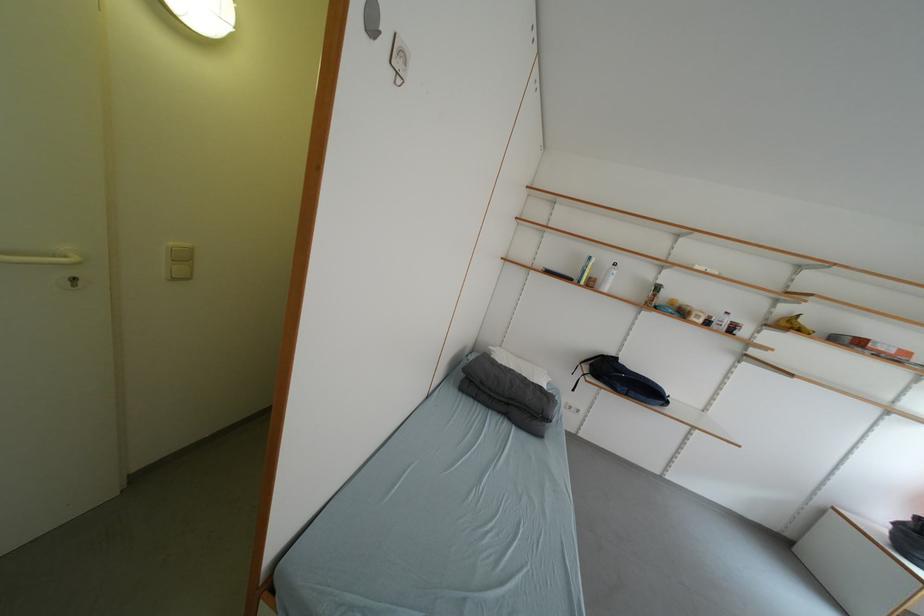
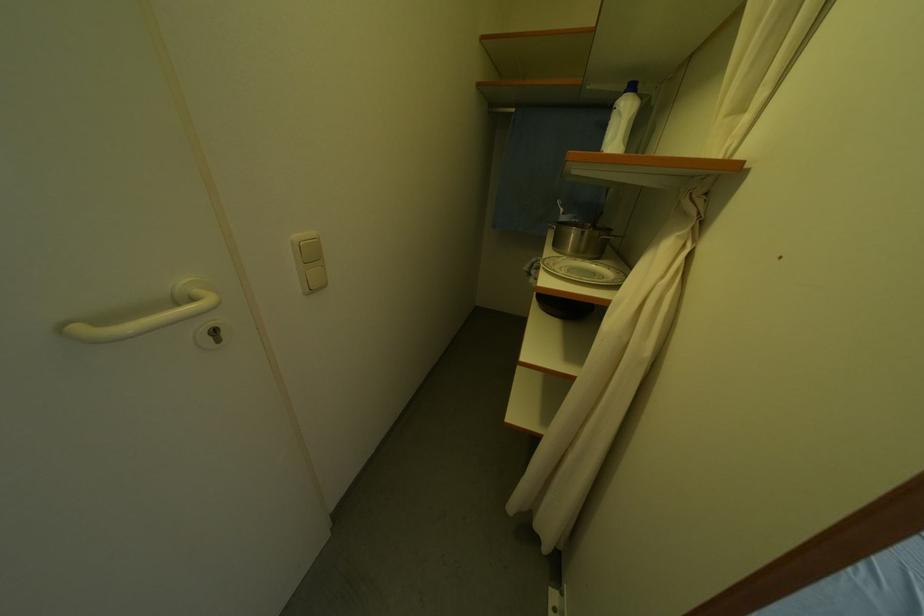
Find the pixel in the second image that matches (x=180, y=246) in the first image.

(306, 238)